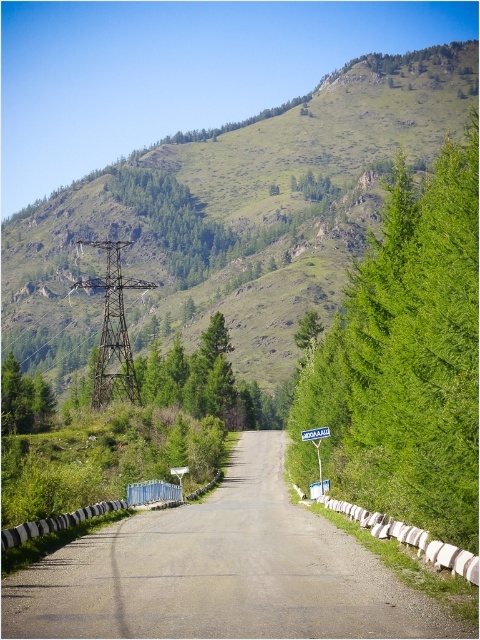
Is green leafy tree at right shorter than green plastic sign at center?

Incorrect, green leafy tree at right's height does not fall short of green plastic sign at center's.

Does green leafy tree at right have a lesser width compared to green plastic sign at center?

No, green leafy tree at right is not thinner than green plastic sign at center.

Which is in front, point (469, 538) or point (319, 440)?

Positioned in front is point (469, 538).

Identify the location of green leafy tree at right. The image size is (480, 640). (407, 356).

Can you confirm if green grassy mountain at upper center is positioned below gray asphalt road at center?

Incorrect, green grassy mountain at upper center is not positioned below gray asphalt road at center.

Who is more distant from viewer, [269,134] or [280,566]?

Positioned behind is point [269,134].

Is point (248, 269) farther from viewer compared to point (295, 506)?

Yes, it is.

This screenshot has height=640, width=480. Find the location of `green grassy mountain at upper center`. green grassy mountain at upper center is located at coordinates click(233, 216).

Which is behind, point (7, 420) or point (314, 429)?

Positioned behind is point (7, 420).

Does green matte tree at left have a larger size compared to green plastic sign at center?

Correct, green matte tree at left is larger in size than green plastic sign at center.

Which is behind, point (0, 384) or point (319, 456)?

The point (0, 384) is behind.

You are a GUI agent. You are given a task and a screenshot of the screen. Output one action in this format:
    pyautogui.click(x=<x>, y=<y>)
    Task: Click on the green matte tree at left
    The width and height of the screenshot is (480, 640).
    Given the screenshot: What is the action you would take?
    pyautogui.click(x=24, y=400)